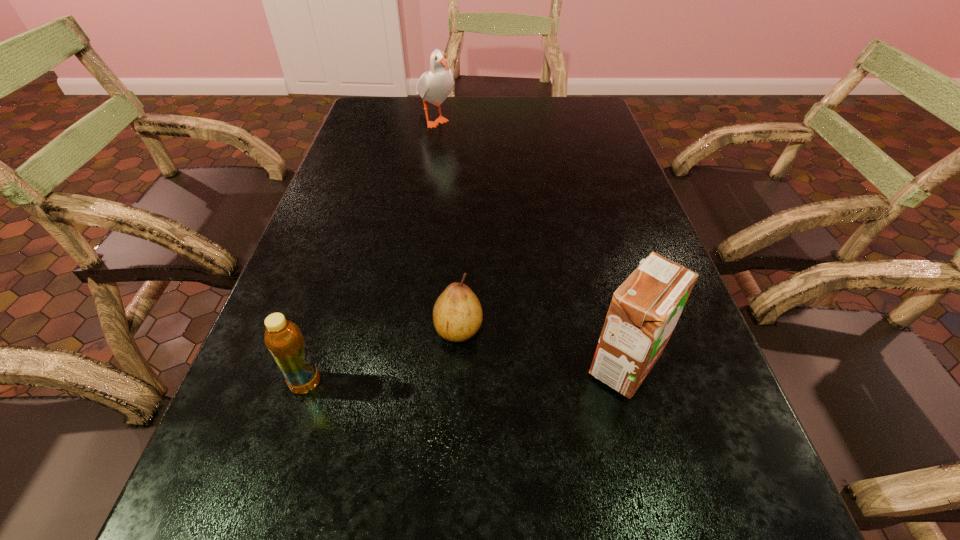
I want to click on gull, so click(434, 86).

Locate an element on the screen. the rightmost object is located at coordinates (645, 308).

This screenshot has height=540, width=960. What are the coordinates of `bottle` in the screenshot? It's located at (283, 338).

Image resolution: width=960 pixels, height=540 pixels. Identify the location of the leftmost object. (283, 338).

Find the location of a particular element. This screenshot has height=540, width=960. pear is located at coordinates (457, 314).

This screenshot has height=540, width=960. Identify the location of vacant space situated 0.210m at the beak of the gull. (426, 176).

In order to click on blank area located 0.100m on the straw side of the carton in this screenshot , I will do `click(528, 364)`.

Locate an element on the screen. Image resolution: width=960 pixels, height=540 pixels. free region located on the straw side of the carton is located at coordinates (413, 364).

Locate an element on the screen. vacant space located on the straw side of the carton is located at coordinates (401, 364).

The height and width of the screenshot is (540, 960). Find the location of `free space located 0.080m on the right of the bottle`. free space located 0.080m on the right of the bottle is located at coordinates (369, 383).